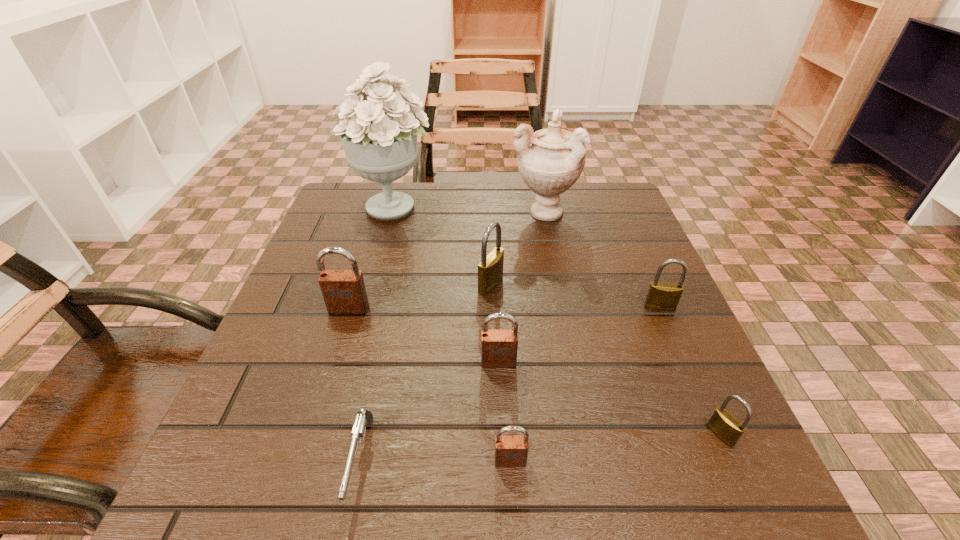
What are the coordinates of `the second farthest brown padlock` in the screenshot? It's located at (499, 348).

This screenshot has height=540, width=960. In order to click on the smallest brass padlock in this screenshot , I will do `click(724, 426)`.

Image resolution: width=960 pixels, height=540 pixels. What are the coordinates of `the second nearest padlock` in the screenshot? It's located at (724, 426).

You are a GUI agent. You are given a task and a screenshot of the screen. Output one action in this format:
    pyautogui.click(x=<x>, y=<y>)
    Task: Click on the nearest padlock
    
    Given the screenshot: What is the action you would take?
    pyautogui.click(x=510, y=451)

Image resolution: width=960 pixels, height=540 pixels. I want to click on the smallest brown padlock, so click(x=510, y=451).

Where is `the shortest object`? the shortest object is located at coordinates (364, 417).

In order to click on silver pistol in this screenshot , I will do `click(364, 417)`.

Find the location of `free space located on the right of the green bouquet`. free space located on the right of the green bouquet is located at coordinates (563, 206).

Identify the location of vacant point located on the right of the seventh object from left to right. This screenshot has width=960, height=540. (619, 211).

You are a GUI agent. You are given a task and a screenshot of the screen. Output one action in this format:
    pyautogui.click(x=<x>, y=<y>)
    Task: Click on the vacant region located 0.060m on the left of the biggest brass padlock
    
    Given the screenshot: What is the action you would take?
    pyautogui.click(x=449, y=284)